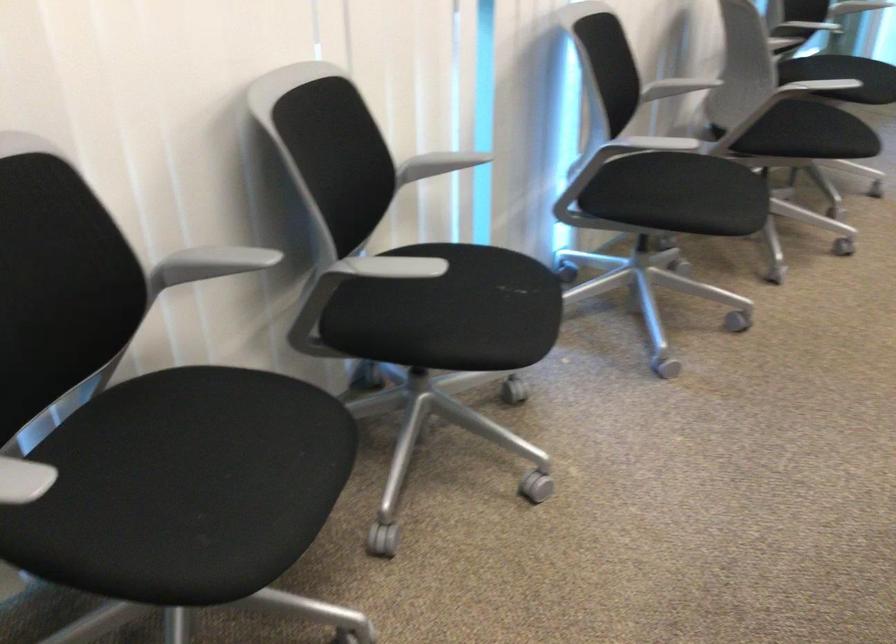
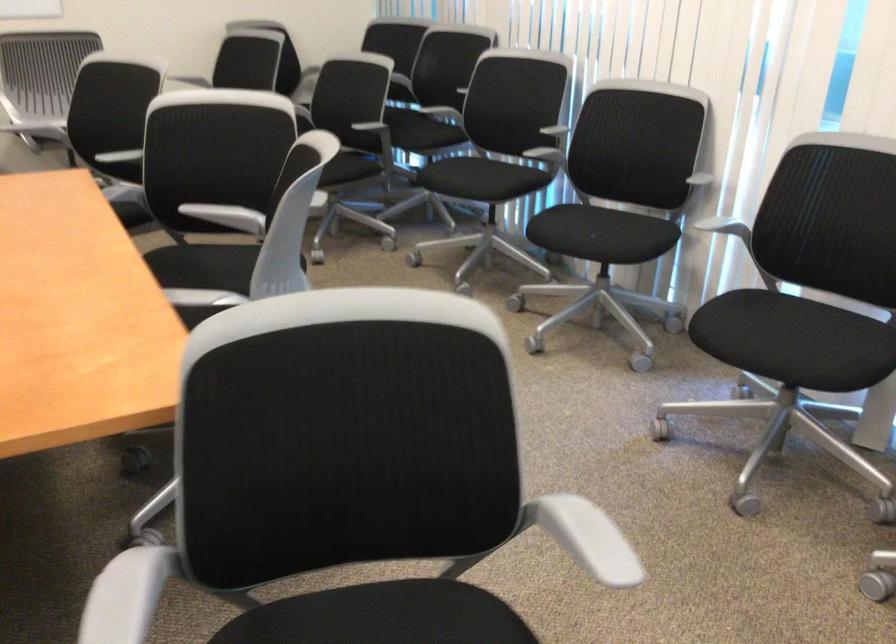
The point at (389, 167) is marked in the first image. Where is the corresponding point in the second image?

(693, 174)